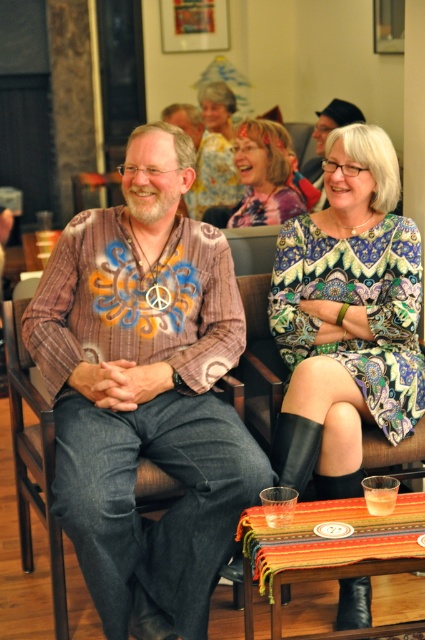
You are a photographer at the event and want to capture both the printed cotton shirt at center and the printed fabric dress at center in a single shot. Which object should you position closer to the left side of the camera frame?

The printed cotton shirt at center should be positioned closer to the left side of the camera frame since it is already located to the left of the printed fabric dress at center in the scene.

From the picture: You are standing in the room and want to hand a gift to the person wearing the printed fabric dress at center and the multicolored printed dress at center. If you can reach 4 feet, can you reach both without moving?

The printed fabric dress at center is 3.86 feet away from the multicolored printed dress at center. Since the distance between them is less than your 4 feet reach, you can reach both without moving.

You are a photographer setting up a tripod to capture a group photo of the printed fabric dress at center and the matte yellow blouse at upper center. The minimum distance your camera can focus clearly on both subjects simultaneously is 6 feet. Based on the scene description, will both subjects be in focus at this distance?

The distance between the printed fabric dress at center and the matte yellow blouse at upper center is 7.35 feet, which exceeds the camera focus range of 6 feet. Therefore, both subjects cannot be in focus simultaneously at this distance.